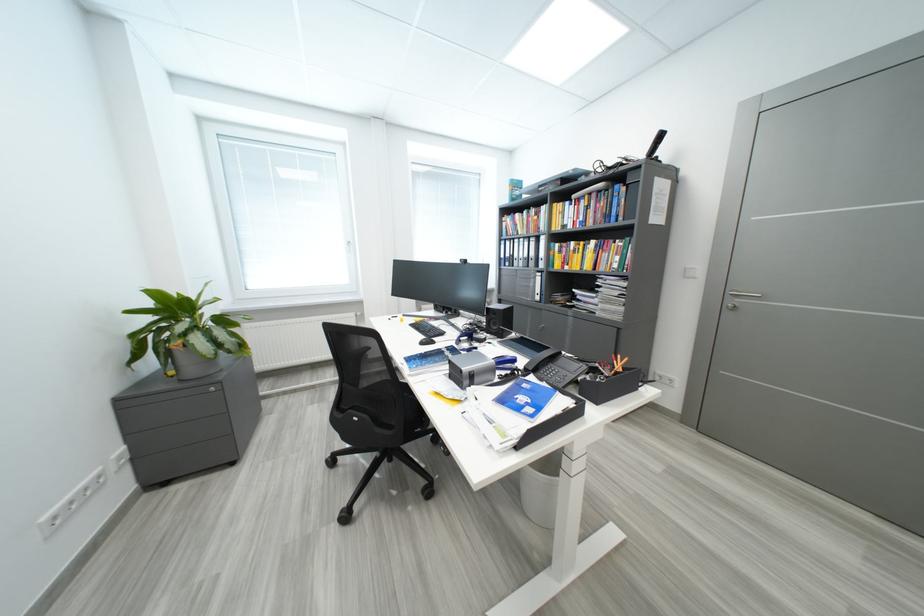
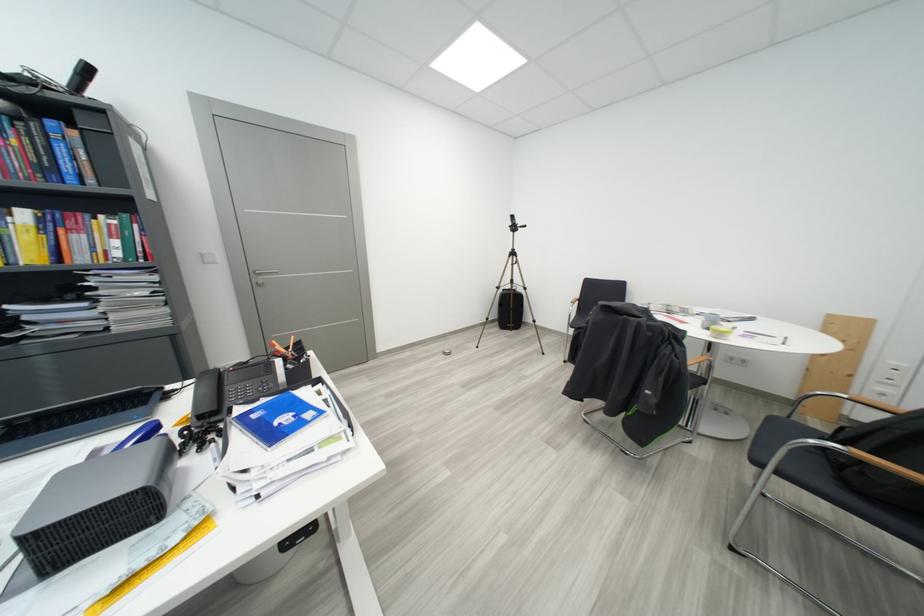
Based on the continuous images, in which direction is the camera rotating?

The rotation direction of the camera is right-down.